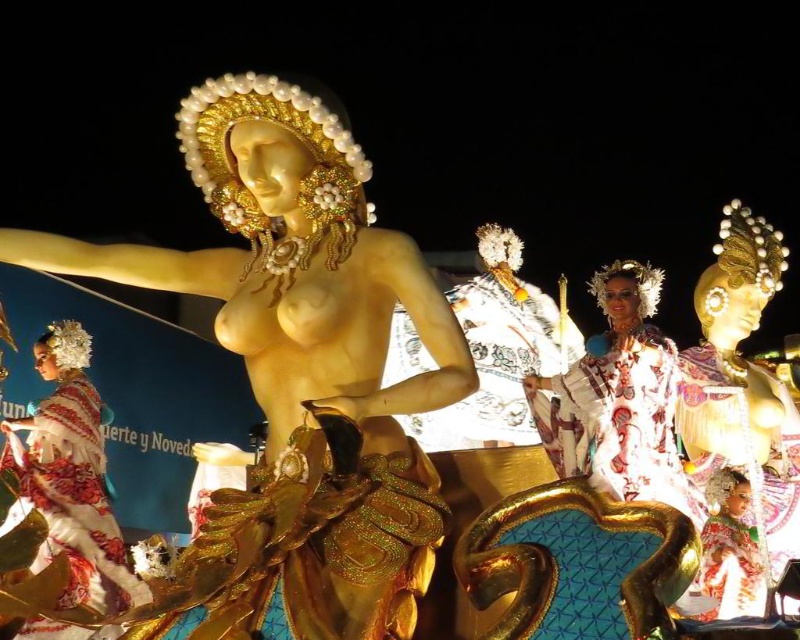
You are an art curator examining the scene. You notice two statues at the center. Which one is closer to you, the gold polished statue at center or the gold metallic statue at center?

The gold polished statue at center is closer to you because it is in front of the gold metallic statue at center.

You are a photographer positioned at the front of the crowd. You want to capture a clear photo of the gold metallic statue at center and the embroidered silk dress at lower left. Which object should you focus on first to ensure it appears sharp in the photo?

The gold metallic statue at center is closer to you than the embroidered silk dress at lower left, so you should focus on the gold metallic statue at center first to ensure it appears sharp in the photo.